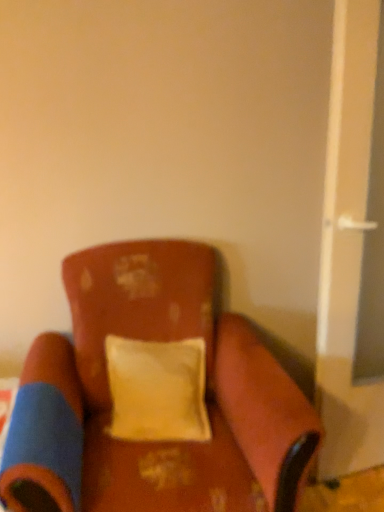
Question: From the image's perspective, relative to yellow fabric pillow at center, is white plastic screen door at right above or below?

Choices:
 (A) below
 (B) above

Answer: (B)

Question: In terms of width, does white plastic screen door at right look wider or thinner when compared to yellow fabric pillow at center?

Choices:
 (A) wide
 (B) thin

Answer: (B)

Question: Considering the real-world distances, which object is closest to the white plastic screen door at right?

Choices:
 (A) velvet-like brown chair at center
 (B) yellow fabric pillow at center

Answer: (B)

Question: Estimate the real-world distances between objects in this image. Which object is closer to the white plastic screen door at right?

Choices:
 (A) velvet-like brown chair at center
 (B) yellow fabric pillow at center

Answer: (B)